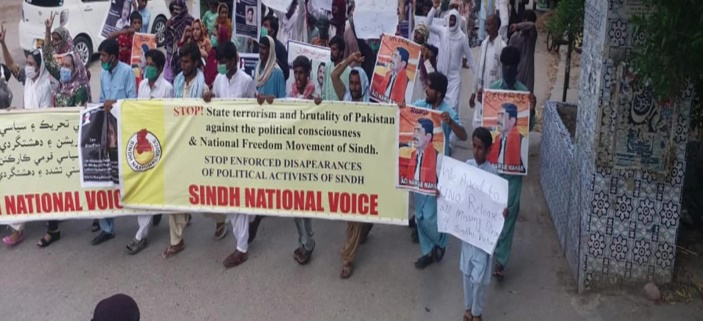
The width and height of the screenshot is (703, 321). In order to click on beige floor in this screenshot , I will do `click(321, 293)`.